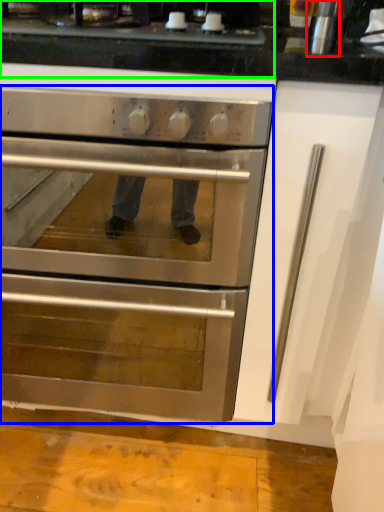
Question: Considering the real-world distances, which object is closest to appliance (highlighted by a red box)? oven (highlighted by a blue box) or gas stove (highlighted by a green box).

Choices:
 (A) oven
 (B) gas stove

Answer: (B)